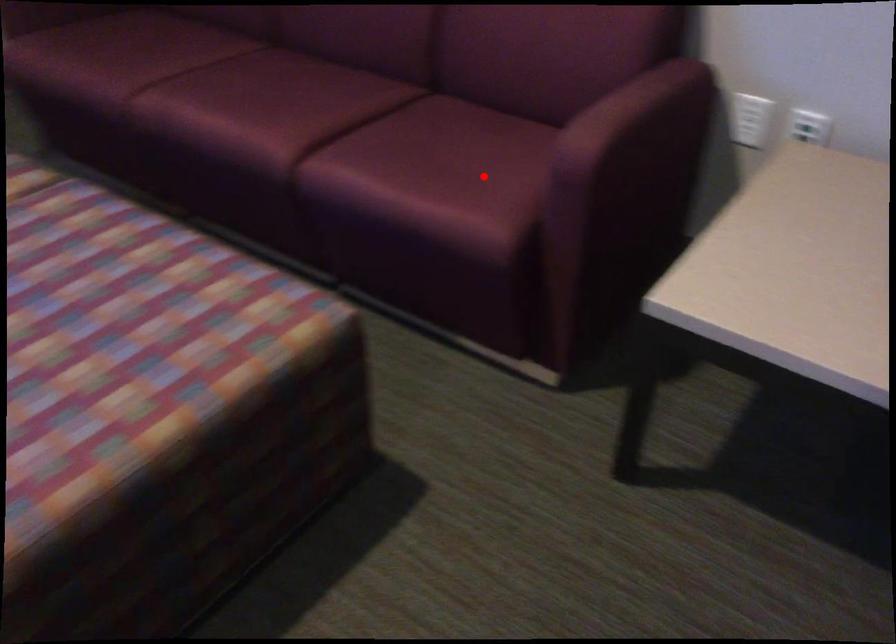
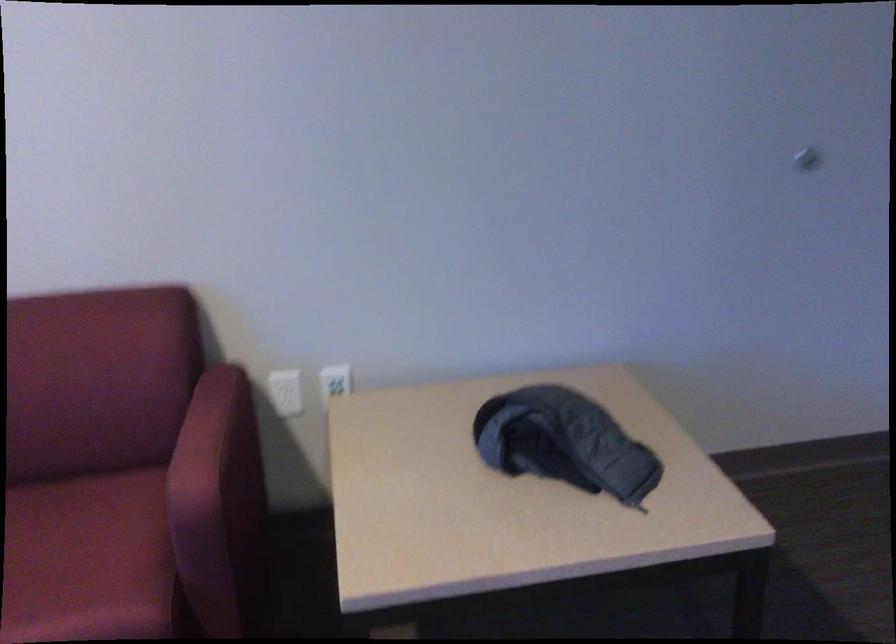
Find the pixel in the second image that matches the highlighted location in the first image.

(88, 560)